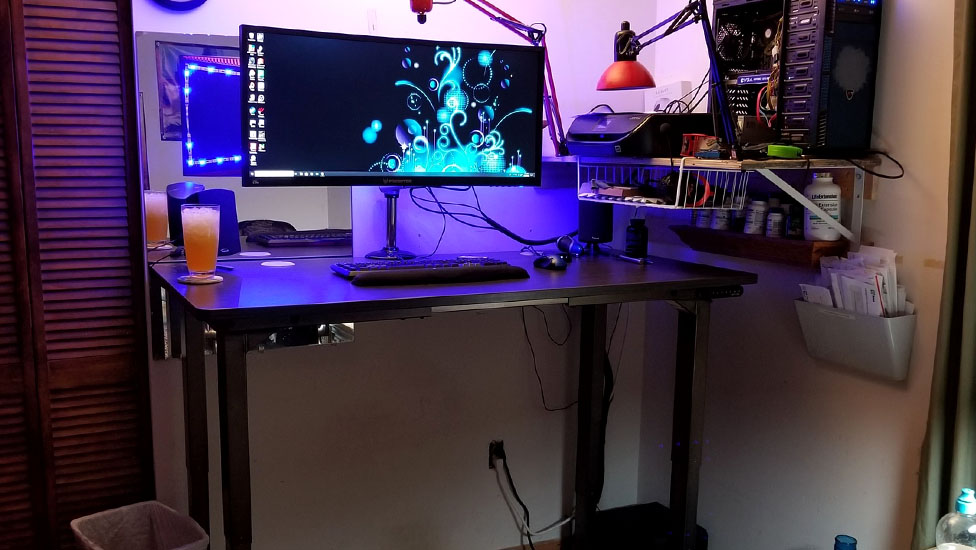
Identify the location of computer. (778, 107).